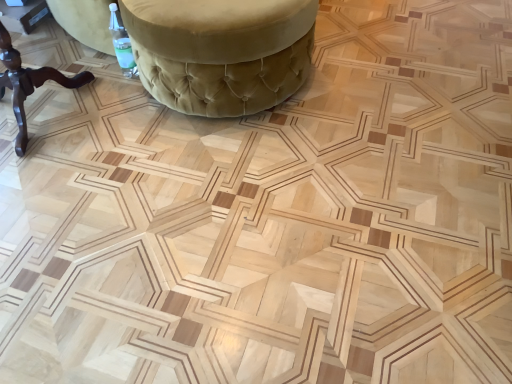
Question: Would you say velvet green ottoman at upper center, acting as the 1th furniture starting from the right, is to the left or to the right of brown wooden table at left, the 2th furniture viewed from the right, in the picture?

Choices:
 (A) right
 (B) left

Answer: (A)

Question: Relative to brown wooden table at left, the 1th furniture in the left-to-right sequence, is velvet green ottoman at upper center, acting as the 1th furniture starting from the right, in front or behind?

Choices:
 (A) behind
 (B) front

Answer: (A)

Question: Is velvet green ottoman at upper center, marked as the second furniture in a left-to-right arrangement, taller or shorter than brown wooden table at left, the 2th furniture viewed from the right?

Choices:
 (A) short
 (B) tall

Answer: (A)

Question: In terms of height, does brown wooden table at left, the 1th furniture in the left-to-right sequence, look taller or shorter compared to velvet green ottoman at upper center, marked as the second furniture in a left-to-right arrangement?

Choices:
 (A) tall
 (B) short

Answer: (A)

Question: Is brown wooden table at left, the 1th furniture in the left-to-right sequence, to the left or to the right of velvet green ottoman at upper center, acting as the 1th furniture starting from the right, in the image?

Choices:
 (A) left
 (B) right

Answer: (A)

Question: In terms of width, does brown wooden table at left, the 2th furniture viewed from the right, look wider or thinner when compared to velvet green ottoman at upper center, acting as the 1th furniture starting from the right?

Choices:
 (A) thin
 (B) wide

Answer: (A)

Question: From the image's perspective, is brown wooden table at left, the 2th furniture viewed from the right, above or below velvet green ottoman at upper center, acting as the 1th furniture starting from the right?

Choices:
 (A) above
 (B) below

Answer: (B)